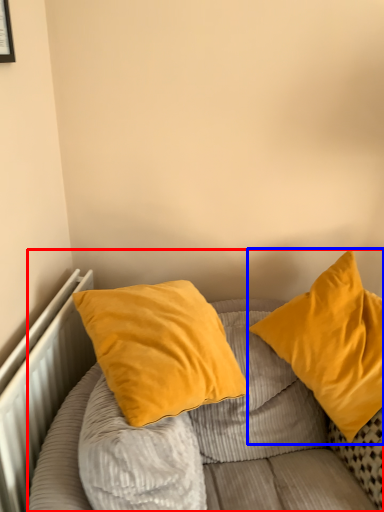
Question: Which of the following is the farthest to the observer, bed (highlighted by a red box) or pillow (highlighted by a blue box)?

Choices:
 (A) bed
 (B) pillow

Answer: (B)